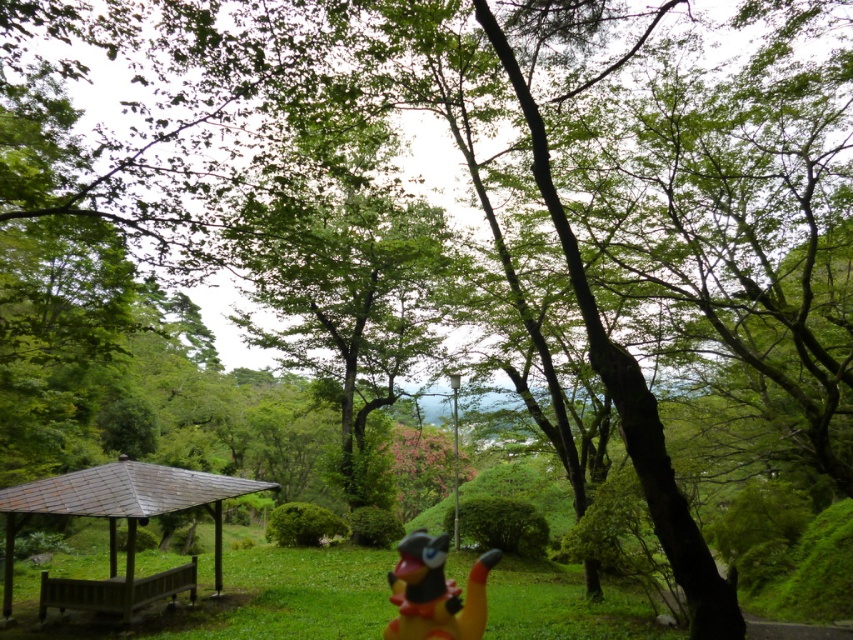
You are standing in the park and see two points marked on the ground. One is at point (112,595) and the other is at point (430,563). Which point is closer to you?

Point (112,595) is closer to you because it is further to the viewer than point (430,563).

You are standing at the entrance of the park and see the brown wooden gazebo at lower left and the rubber yellow toy at center. Which object is positioned more to the left side of the park?

The brown wooden gazebo at lower left is positioned more to the left side of the park than the rubber yellow toy at center.